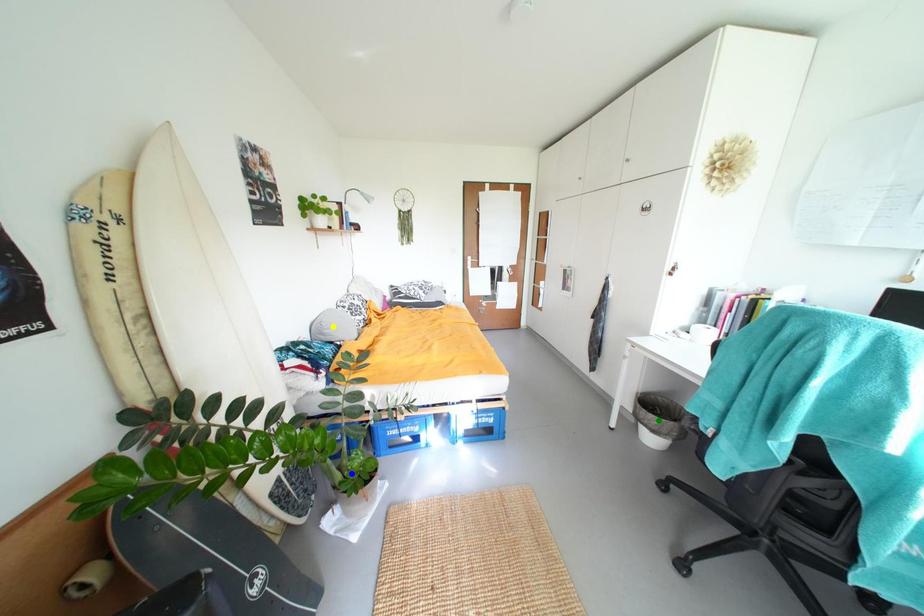
Order these from nearest to farthest:
- yellow point
- green point
- blue point

blue point
green point
yellow point